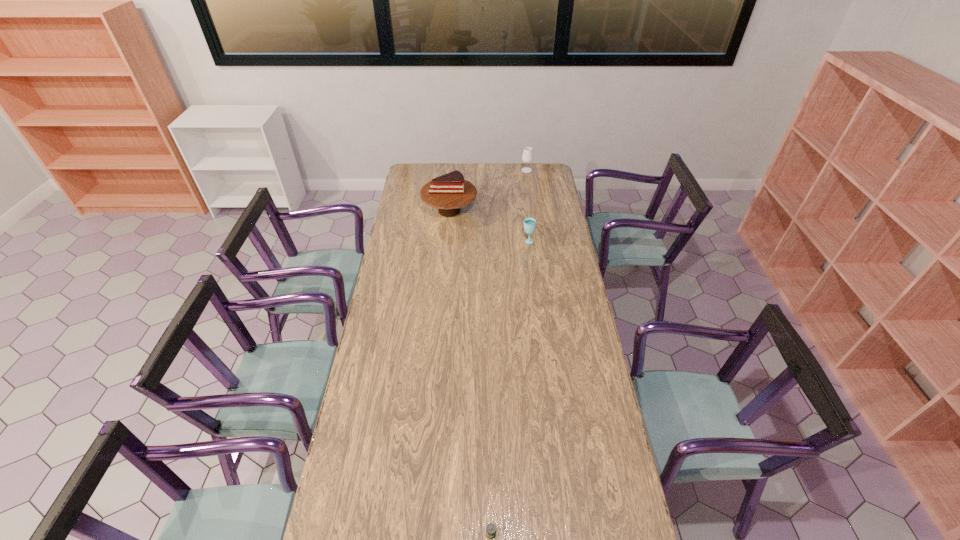
You are a GUI agent. You are given a task and a screenshot of the screen. Output one action in this format:
    pyautogui.click(x=<x>, y=<y>)
    Task: Click on the free location that satisfies the following two spatial constraints: 1. on the front side of the second farthest object; 2. on the left side of the second nearest object
    This screenshot has width=960, height=540.
    Given the screenshot: What is the action you would take?
    pyautogui.click(x=446, y=241)

Image resolution: width=960 pixels, height=540 pixels. What are the coordinates of `blank area in the image that satisfies the following two spatial constraints: 1. on the back side of the farther glass; 2. on the right side of the second nearest object` in the screenshot? It's located at (519, 170).